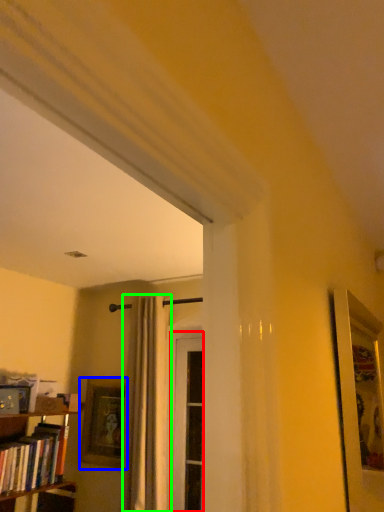
Question: Considering the real-world distances, which object is farthest from screen door (highlighted by a red box)? picture frame (highlighted by a blue box) or curtain (highlighted by a green box)?

Choices:
 (A) picture frame
 (B) curtain

Answer: (A)